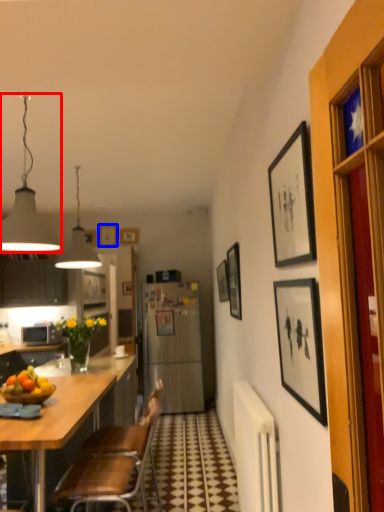
Question: Which object is closer to the camera taking this photo, lamp (highlighted by a red box) or picture frame (highlighted by a blue box)?

Choices:
 (A) lamp
 (B) picture frame

Answer: (A)